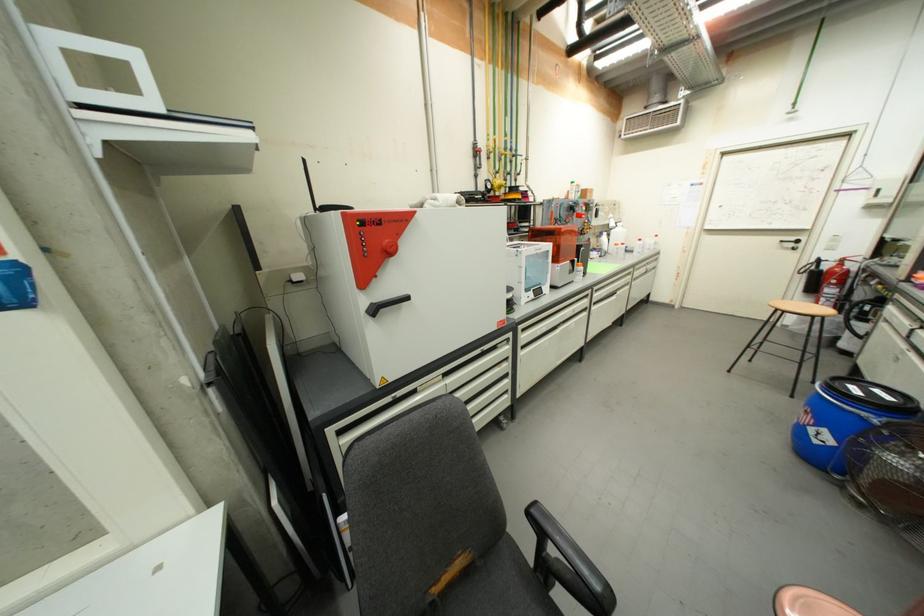
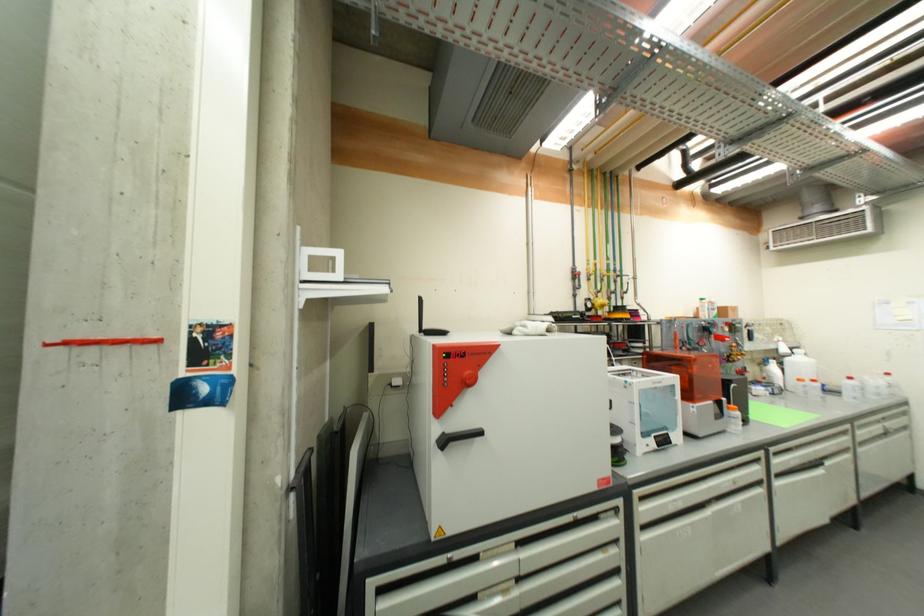
Find the pixel in the second image that matches [606,246] in the first image.

(774, 378)